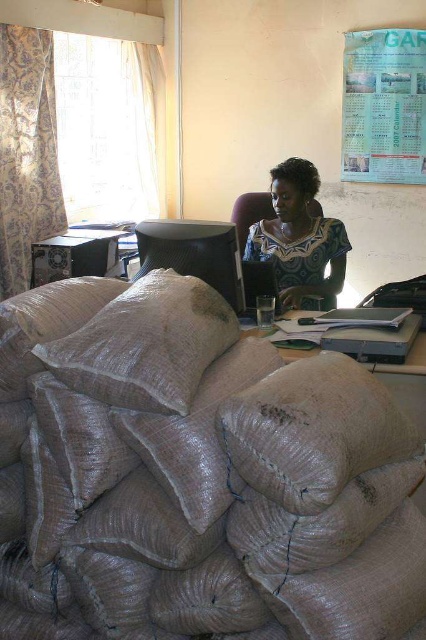
You are standing in the office and want to move from point A to point B. Point A is at coordinate (408, 422) and point B is at coordinate (373, 368). Since you can only move forward, which point will you reach first?

Since point A at coordinate (408, 422) is closer to the viewer than point B at coordinate (373, 368), you will reach point A first if moving forward.

Consider the image. You are organizing items in an office and need to place the burlap sack at lower center and the matte plastic table at center. Which object has a greater width?

The burlap sack at lower center has a greater width than the matte plastic table at center.